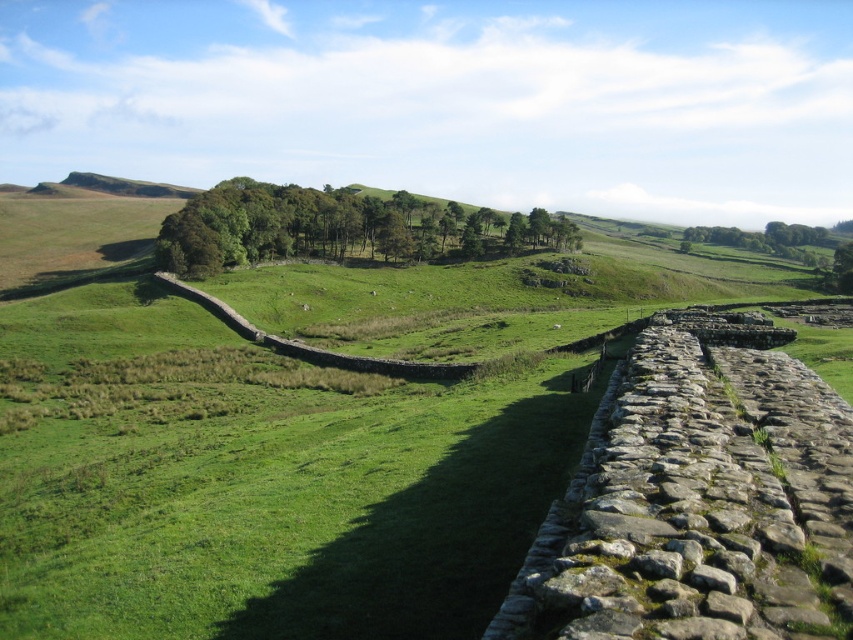
Question: Can you confirm if green grass at center is positioned to the left of green leafy trees at center?

Choices:
 (A) yes
 (B) no

Answer: (B)

Question: Which of the following is the farthest from the observer?

Choices:
 (A) (143, 234)
 (B) (351, 195)

Answer: (A)

Question: Among these points, which one is farthest from the camera?

Choices:
 (A) (560, 426)
 (B) (408, 196)

Answer: (B)

Question: Does green grass at center appear over green leafy trees at center?

Choices:
 (A) no
 (B) yes

Answer: (A)

Question: Is green grass at center thinner than green leafy trees at center?

Choices:
 (A) no
 (B) yes

Answer: (A)